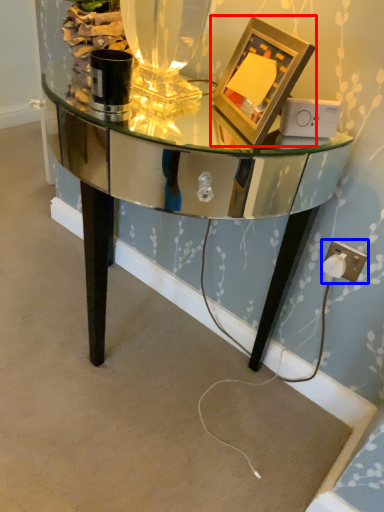
Question: Which object is closer to the camera taking this photo, picture frame (highlighted by a red box) or electric outlet (highlighted by a blue box)?

Choices:
 (A) picture frame
 (B) electric outlet

Answer: (A)